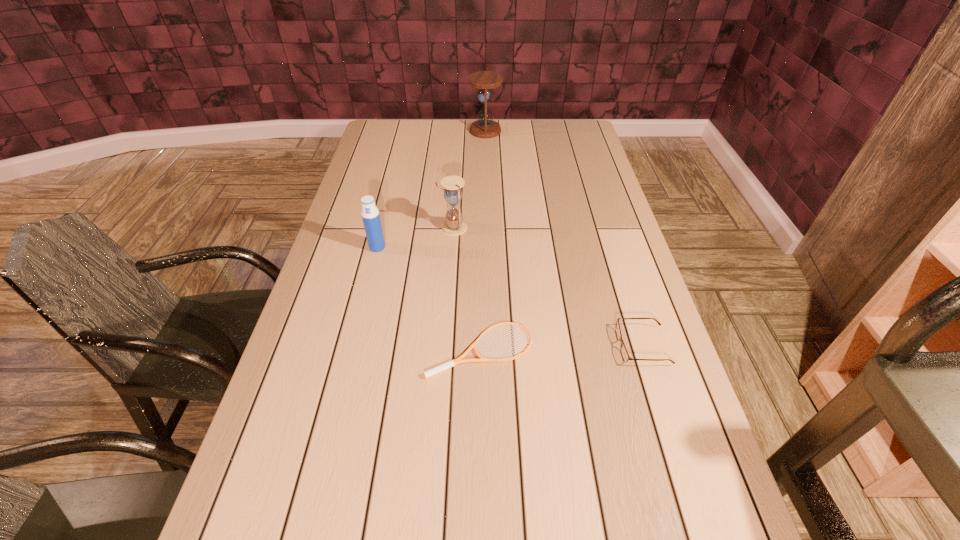
You are a GUI agent. You are given a task and a screenshot of the screen. Output one action in this format:
    pyautogui.click(x=<x>, y=<y>)
    Task: Click on the vacant space at the far left corner of the desktop
    The image size is (960, 540).
    Given the screenshot: What is the action you would take?
    pyautogui.click(x=408, y=128)

Image resolution: width=960 pixels, height=540 pixels. In the image, there is a desktop. Identify the location of vacant space at the far right corner. (582, 120).

At what (x,y) coordinates should I click in order to perform the action: click on free space between the nearer hourglass and the farther hourglass. Please return your answer as a coordinate pair (x, y). This screenshot has width=960, height=540. Looking at the image, I should click on (469, 179).

The width and height of the screenshot is (960, 540). In order to click on free space between the leftmost object and the tennis racket in this screenshot , I will do `click(429, 298)`.

Image resolution: width=960 pixels, height=540 pixels. I want to click on free space that is in between the farthest object and the second shortest object, so click(x=564, y=239).

Find the location of a particular element. This screenshot has height=540, width=960. vacant area that lies between the water bottle and the fourth nearest object is located at coordinates [416, 238].

Find the location of a particular element. unoccupied area between the rightmost object and the second farthest object is located at coordinates (548, 287).

This screenshot has width=960, height=540. I want to click on free space between the water bottle and the farther hourglass, so click(431, 189).

Image resolution: width=960 pixels, height=540 pixels. Find the location of `vacant area that lies between the leftmost object and the nearer hourglass`. vacant area that lies between the leftmost object and the nearer hourglass is located at coordinates (416, 238).

Where is `empty space between the third nearest object and the farther hourglass`? empty space between the third nearest object and the farther hourglass is located at coordinates (431, 189).